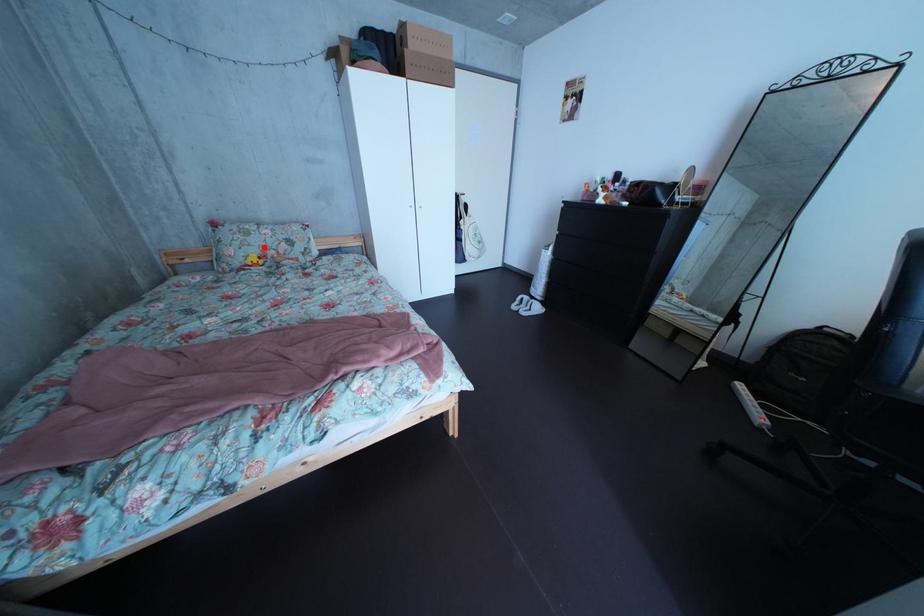
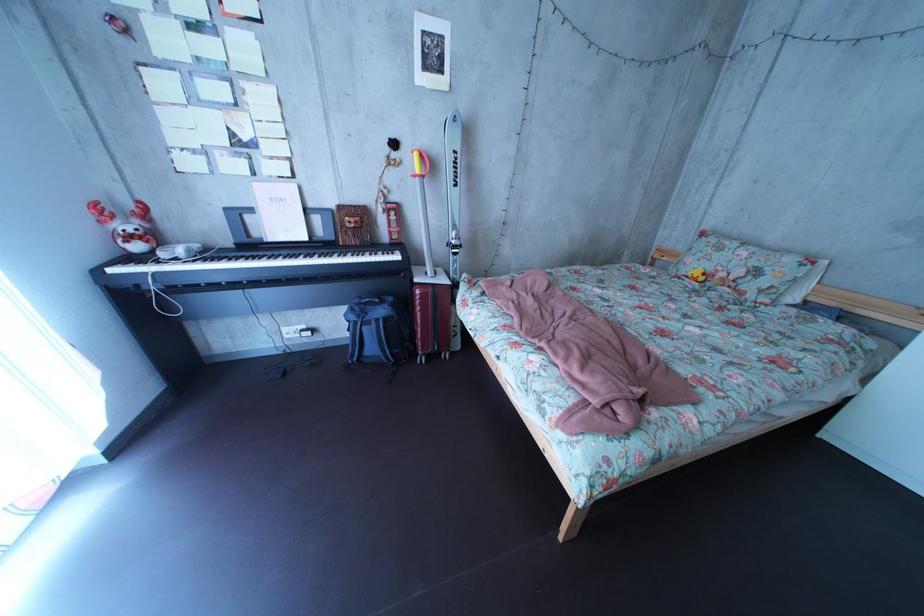
The point at the highlighted location is marked in the first image. Where is the corresponding point in the second image?

(731, 262)